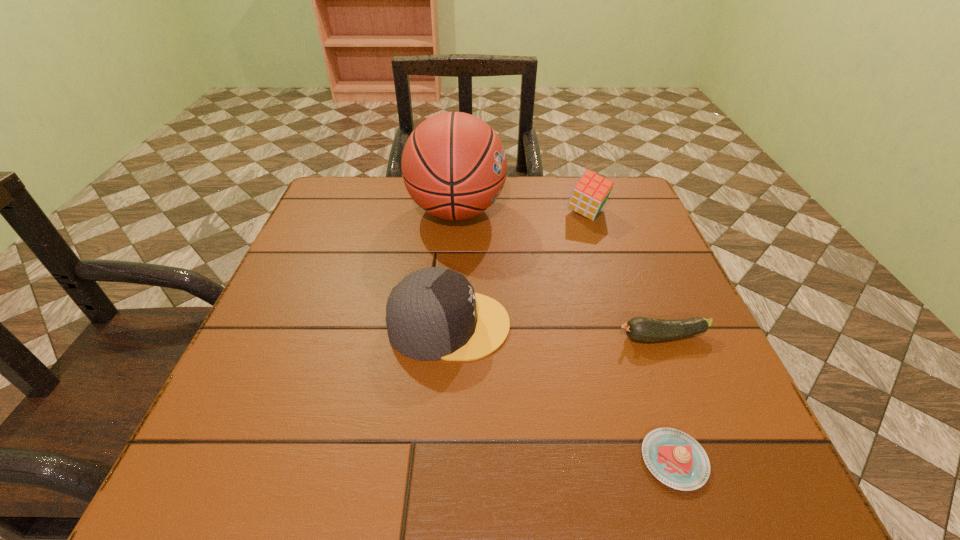
This screenshot has height=540, width=960. In order to click on the tallest object in this screenshot , I will do `click(454, 166)`.

This screenshot has width=960, height=540. Identify the location of cap. (433, 313).

The image size is (960, 540). What are the coordinates of `cube` in the screenshot? It's located at (589, 195).

Where is `the fourth tallest object`? the fourth tallest object is located at coordinates pos(642,329).

Identify the location of the nearest object. (675, 458).

Locate an element on the screen. the shortest object is located at coordinates (675, 458).

Where is `vacant region located on the logo side of the basketball`? This screenshot has width=960, height=540. vacant region located on the logo side of the basketball is located at coordinates (567, 211).

The width and height of the screenshot is (960, 540). In order to click on vacant space situated on the front-facing side of the cap in this screenshot , I will do `click(557, 325)`.

What are the coordinates of `vacant space located 0.190m on the front of the cube` in the screenshot? It's located at (608, 279).

Where is `vacant point located at the blossom end of the fourth tallest object`? The image size is (960, 540). vacant point located at the blossom end of the fourth tallest object is located at coordinates (508, 338).